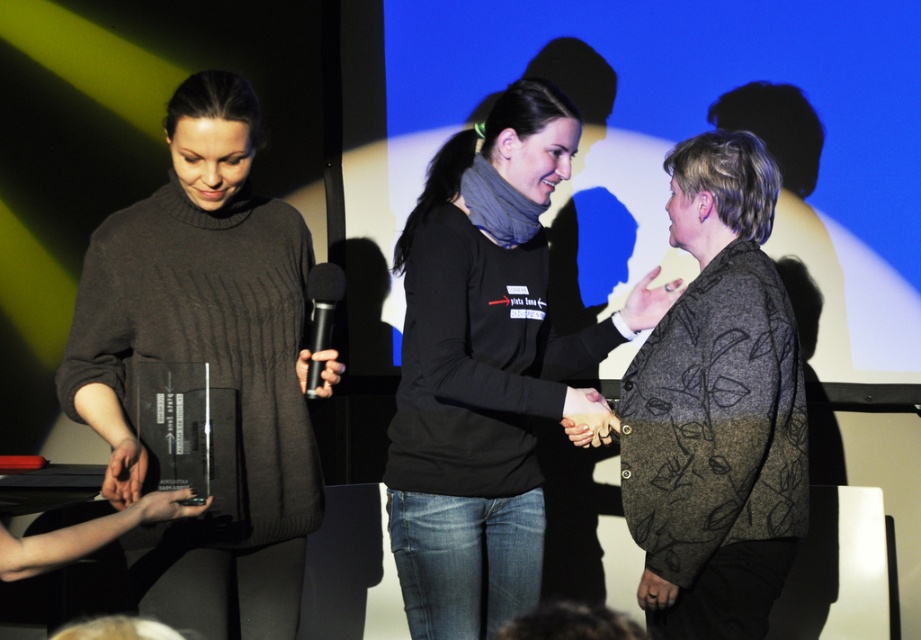
Looking at this image, does black matte shirt at center have a larger size compared to black matte microphone at center?

Yes, black matte shirt at center is bigger than black matte microphone at center.

Is black matte shirt at center to the right of black matte microphone at center from the viewer's perspective?

Yes, black matte shirt at center is to the right of black matte microphone at center.

Is point (449, 394) positioned after point (330, 284)?

Yes, it is.

Locate an element on the screen. black matte shirt at center is located at coordinates (487, 368).

Describe the element at coordinates (487, 368) in the screenshot. I see `black matte shirt at center` at that location.

Describe the element at coordinates (487, 368) in the screenshot. I see `black matte shirt at center` at that location.

I want to click on black matte shirt at center, so click(487, 368).

Between point (707, 276) and point (315, 372), which one is positioned in front?

Point (315, 372)

Between floral-patterned woolen jacket at center and black matte microphone at center, which one appears on the left side from the viewer's perspective?

Positioned to the left is black matte microphone at center.

Is point (719, 282) farther from viewer compared to point (318, 332)?

Yes.

Where is `floral-patterned woolen jacket at center`? This screenshot has height=640, width=921. floral-patterned woolen jacket at center is located at coordinates (717, 408).